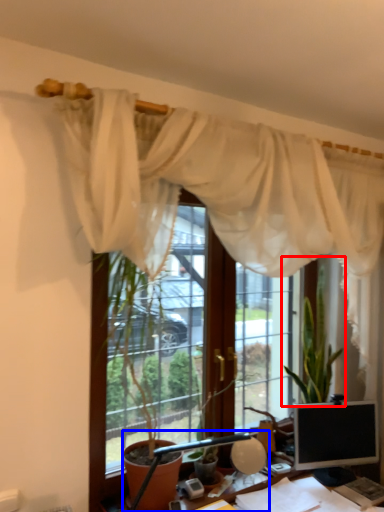
Question: Which of the following is the farthest to the observer, houseplant (highlighted by a red box) or table lamp (highlighted by a blue box)?

Choices:
 (A) houseplant
 (B) table lamp

Answer: (A)